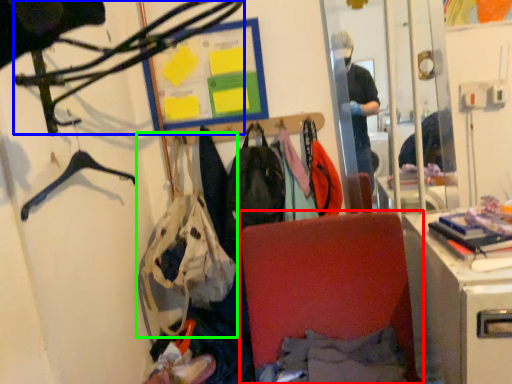
Question: Which object is the closest to the folding chair (highlighted by a red box)? Choose among these: hanger (highlighted by a blue box) or handbag (highlighted by a green box).

Choices:
 (A) hanger
 (B) handbag

Answer: (B)